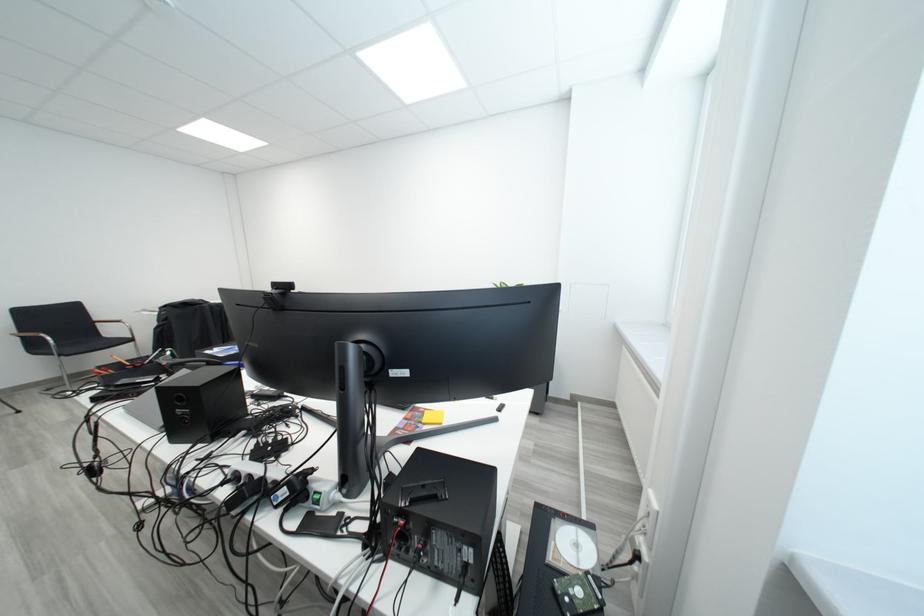
Where would you grip the chair armrest? Please return your answer as a coordinate pair (x, y).

(33, 334)